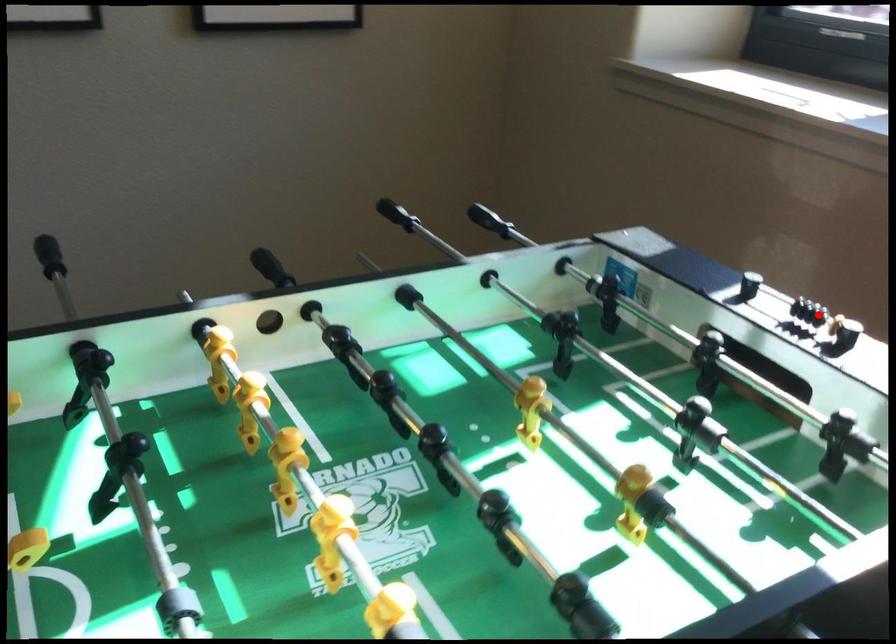
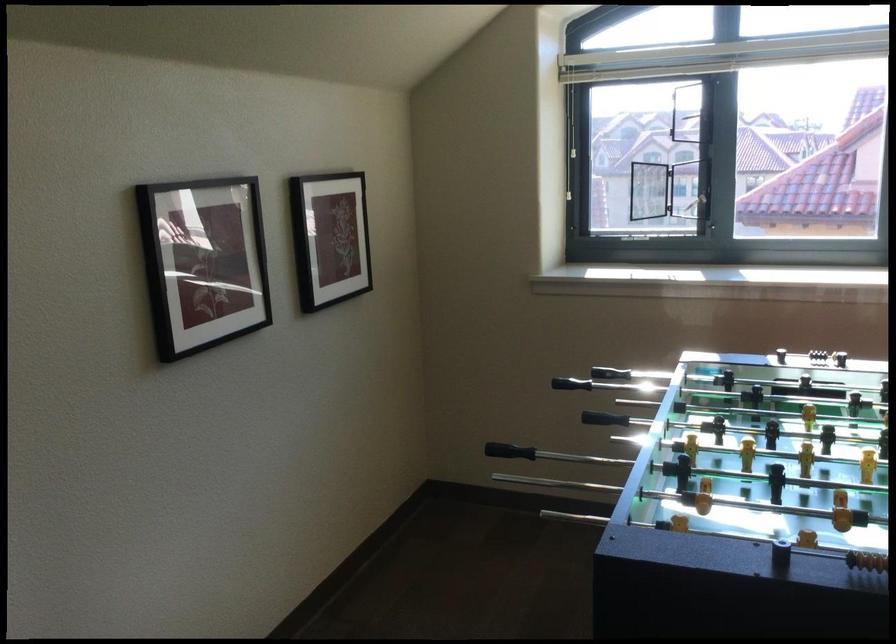
Question: A red point is marked in image1. In image2, is the corresponding 3D point closer to the camera or farther? Reply with the corresponding letter.

Choices:
 (A) The corresponding 3D point is closer.
 (B) The corresponding 3D point is farther.

Answer: (B)